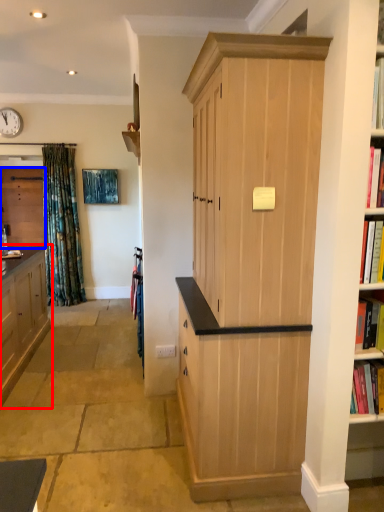
Question: Which point is closer to the camera, cabinetry (highlighted by a red box) or cabinetry (highlighted by a blue box)?

Choices:
 (A) cabinetry
 (B) cabinetry

Answer: (A)